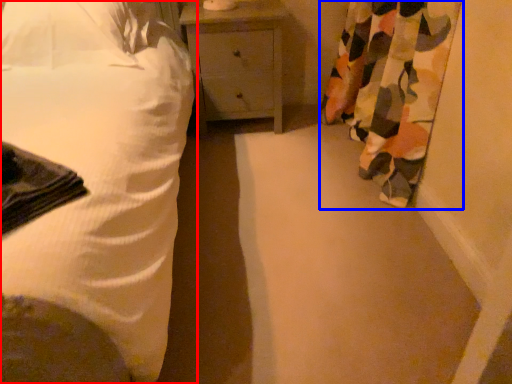
Question: Which of the following is the farthest to the observer, bed (highlighted by a red box) or curtain (highlighted by a blue box)?

Choices:
 (A) bed
 (B) curtain

Answer: (B)